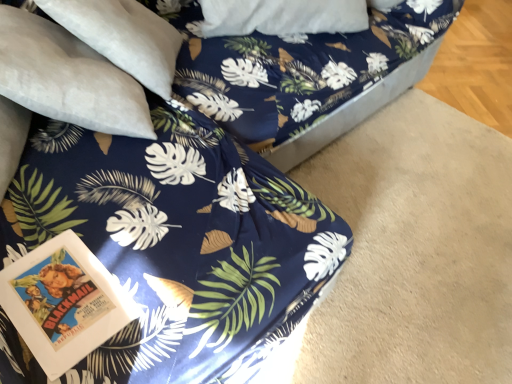
Image resolution: width=512 pixels, height=384 pixels. What do you see at coordinates (67, 78) in the screenshot? I see `suede-like beige pillow at upper left` at bounding box center [67, 78].

Where is `suede-like beige pillow at upper left`? suede-like beige pillow at upper left is located at coordinates (67, 78).

Measure the distance between point (131, 93) and camera.

4.24 feet.

The height and width of the screenshot is (384, 512). What do you see at coordinates (303, 74) in the screenshot?
I see `blue fabric bed frame at center` at bounding box center [303, 74].

This screenshot has width=512, height=384. In order to click on blue fabric bed frame at center in this screenshot , I will do `click(303, 74)`.

In order to click on suede-like beige pillow at upper left in this screenshot , I will do `click(67, 78)`.

Does suede-like beige pillow at upper left appear on the left side of blue fabric bed frame at center?

Yes.

Between suede-like beige pillow at upper left and blue fabric bed frame at center, which one is positioned behind?

Positioned behind is blue fabric bed frame at center.

Which is closer, (0, 22) or (201, 22)?

The point (0, 22) is closer to the camera.

From the image's perspective, which object appears higher, suede-like beige pillow at upper left or blue fabric bed frame at center?

blue fabric bed frame at center, from the image's perspective.

From a real-world perspective, is suede-like beige pillow at upper left positioned over blue fabric bed frame at center based on gravity?

Yes, from a real-world perspective, suede-like beige pillow at upper left is over blue fabric bed frame at center

Which of these two, suede-like beige pillow at upper left or blue fabric bed frame at center, is wider?

With larger width is blue fabric bed frame at center.

From their relative heights in the image, would you say suede-like beige pillow at upper left is taller or shorter than blue fabric bed frame at center?

In the image, suede-like beige pillow at upper left appears to be shorter than blue fabric bed frame at center.

Considering the sizes of objects suede-like beige pillow at upper left and blue fabric bed frame at center in the image provided, who is bigger, suede-like beige pillow at upper left or blue fabric bed frame at center?

blue fabric bed frame at center.

Can we say suede-like beige pillow at upper left lies outside blue fabric bed frame at center?

Actually, suede-like beige pillow at upper left is at least partially inside blue fabric bed frame at center.

Is suede-like beige pillow at upper left far away from blue fabric bed frame at center?

No, suede-like beige pillow at upper left is in close proximity to blue fabric bed frame at center.

Is suede-like beige pillow at upper left aimed at blue fabric bed frame at center?

Yes, suede-like beige pillow at upper left is oriented towards blue fabric bed frame at center.

How far apart are suede-like beige pillow at upper left and blue fabric bed frame at center?

A distance of 23.10 inches exists between suede-like beige pillow at upper left and blue fabric bed frame at center.

I want to click on bed frame located above the suede-like beige pillow at upper left (from the image's perspective), so click(303, 74).

Can you confirm if blue fabric bed frame at center is positioned to the left of suede-like beige pillow at upper left?

Incorrect, blue fabric bed frame at center is not on the left side of suede-like beige pillow at upper left.

Consider the image. Relative to suede-like beige pillow at upper left, is blue fabric bed frame at center in front or behind?

Clearly, blue fabric bed frame at center is behind suede-like beige pillow at upper left.

Is point (272, 144) farther from viewer compared to point (25, 92)?

Yes.

From the image's perspective, is blue fabric bed frame at center above or below suede-like beige pillow at upper left?

Based on their image positions, blue fabric bed frame at center is located above suede-like beige pillow at upper left.

From a real-world perspective, between blue fabric bed frame at center and suede-like beige pillow at upper left, who is vertically higher?

From a 3D spatial view, suede-like beige pillow at upper left is above.

Between blue fabric bed frame at center and suede-like beige pillow at upper left, which one has larger width?

blue fabric bed frame at center.

Can you confirm if blue fabric bed frame at center is taller than suede-like beige pillow at upper left?

Indeed, blue fabric bed frame at center has a greater height compared to suede-like beige pillow at upper left.

Who is bigger, blue fabric bed frame at center or suede-like beige pillow at upper left?

With larger size is blue fabric bed frame at center.

Would you say blue fabric bed frame at center is inside or outside suede-like beige pillow at upper left?

A: blue fabric bed frame at center is not enclosed by suede-like beige pillow at upper left.

Is blue fabric bed frame at center not near suede-like beige pillow at upper left?

blue fabric bed frame at center is actually quite close to suede-like beige pillow at upper left.

Is blue fabric bed frame at center oriented away from suede-like beige pillow at upper left?

No, blue fabric bed frame at center's orientation is not away from suede-like beige pillow at upper left.

How much distance is there between blue fabric bed frame at center and suede-like beige pillow at upper left?

blue fabric bed frame at center and suede-like beige pillow at upper left are 23.10 inches apart from each other.

Locate an element on the screen. This screenshot has height=384, width=512. pillow below the blue fabric bed frame at center (from the image's perspective) is located at coordinates (67, 78).

I want to click on pillow lying on the left of blue fabric bed frame at center, so click(67, 78).

Find the location of a particular element. pillow positioned vertically above the blue fabric bed frame at center (from a real-world perspective) is located at coordinates [x=67, y=78].